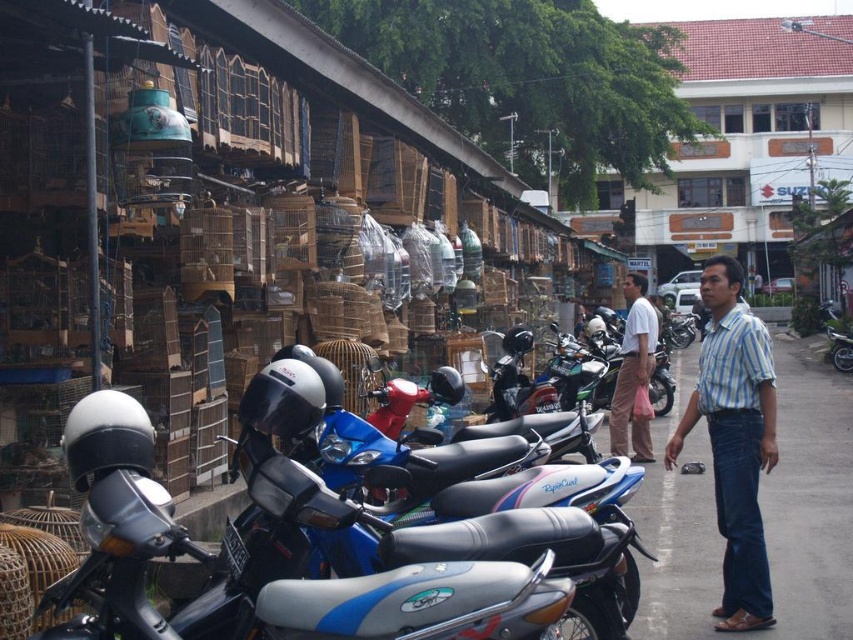
Measure the distance from blue striped shirt at center to white shirt at center.

blue striped shirt at center and white shirt at center are 7.84 feet apart.

Is blue striped shirt at center taller than white shirt at center?

Yes.

Where is `blue striped shirt at center`? blue striped shirt at center is located at coordinates point(734,440).